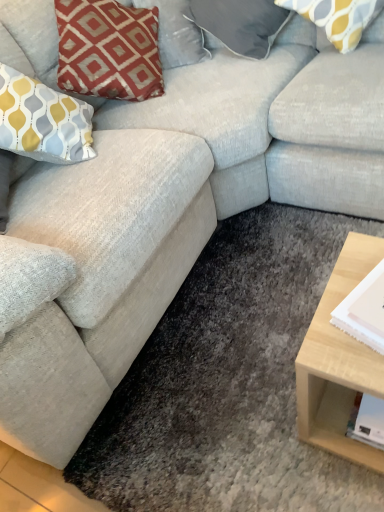
In order to face white paper at right, should I rotate leftwards or rightwards?

You should rotate right by 29.038 degrees.

Where is `white paper at right`? The width and height of the screenshot is (384, 512). white paper at right is located at coordinates (356, 317).

Is satin gray pillow at upper center, arranged as the 1th pillow when viewed from the left, oriented away from white paper at right?

No, white paper at right is not at the back of satin gray pillow at upper center, arranged as the 1th pillow when viewed from the left.

Considering the positions of objects satin gray pillow at upper center, arranged as the 1th pillow when viewed from the left, and white paper at right in the image provided, who is more to the right, satin gray pillow at upper center, arranged as the 1th pillow when viewed from the left, or white paper at right?

Positioned to the right is white paper at right.

This screenshot has width=384, height=512. There is a white paper at right. What are the coordinates of `the 1st pillow above it (from a real-world perspective)` in the screenshot? It's located at (240, 23).

From a real-world perspective, who is located higher, satin gray pillow at upper center, arranged as the 1th pillow when viewed from the left, or white paper at right?

In real-world perspective, satin gray pillow at upper center, arranged as the 1th pillow when viewed from the left, is above.

Is yellow and gray patterned pillow at upper right, positioned as the 2th pillow in left-to-right order, positioned before white paper at right?

No, yellow and gray patterned pillow at upper right, positioned as the 2th pillow in left-to-right order, is behind white paper at right.

Is yellow and gray patterned pillow at upper right, which appears as the first pillow when viewed from the right, inside or outside of white paper at right?

yellow and gray patterned pillow at upper right, which appears as the first pillow when viewed from the right, is not enclosed by white paper at right.

From a real-world perspective, who is located higher, yellow and gray patterned pillow at upper right, which appears as the first pillow when viewed from the right, or white paper at right?

yellow and gray patterned pillow at upper right, which appears as the first pillow when viewed from the right, from a real-world perspective.

Is yellow and gray patterned pillow at upper right, positioned as the 2th pillow in left-to-right order, facing towards white paper at right?

Yes, yellow and gray patterned pillow at upper right, positioned as the 2th pillow in left-to-right order, faces towards white paper at right.

Is the surface of yellow and gray patterned pillow at upper right, which appears as the first pillow when viewed from the right, in direct contact with satin gray pillow at upper center, arranged as the 1th pillow when viewed from the left?

yellow and gray patterned pillow at upper right, which appears as the first pillow when viewed from the right, is not next to satin gray pillow at upper center, arranged as the 1th pillow when viewed from the left, and they're not touching.

Does yellow and gray patterned pillow at upper right, which appears as the first pillow when viewed from the right, have a lesser width compared to satin gray pillow at upper center, arranged as the 1th pillow when viewed from the left?

Indeed, yellow and gray patterned pillow at upper right, which appears as the first pillow when viewed from the right, has a lesser width compared to satin gray pillow at upper center, arranged as the 1th pillow when viewed from the left.

From a real-world perspective, is yellow and gray patterned pillow at upper right, positioned as the 2th pillow in left-to-right order, located beneath satin gray pillow at upper center, which appears as the 2th pillow when viewed from the right?

Actually, yellow and gray patterned pillow at upper right, positioned as the 2th pillow in left-to-right order, is physically above satin gray pillow at upper center, which appears as the 2th pillow when viewed from the right, in the real world.

Is yellow and gray patterned pillow at upper right, positioned as the 2th pillow in left-to-right order, behind satin gray pillow at upper center, arranged as the 1th pillow when viewed from the left?

No.

Is white paper at right turned away from satin gray pillow at upper center, which appears as the 2th pillow when viewed from the right?

That's not correct — white paper at right is not looking away from satin gray pillow at upper center, which appears as the 2th pillow when viewed from the right.

In order to click on magazine located underneath the satin gray pillow at upper center, arranged as the 1th pillow when viewed from the left (from a real-world perspective) in this screenshot , I will do `click(356, 317)`.

From a real-world perspective, is white paper at right over satin gray pillow at upper center, arranged as the 1th pillow when viewed from the left?

No, from a real-world perspective, white paper at right is not over satin gray pillow at upper center, arranged as the 1th pillow when viewed from the left

Based on their sizes in the image, would you say white paper at right is bigger or smaller than satin gray pillow at upper center, which appears as the 2th pillow when viewed from the right?

In the image, white paper at right appears to be smaller than satin gray pillow at upper center, which appears as the 2th pillow when viewed from the right.

In the scene shown: Considering their positions, is white paper at right located in front of or behind yellow and gray patterned pillow at upper right, which appears as the first pillow when viewed from the right?

white paper at right is positioned closer to the viewer than yellow and gray patterned pillow at upper right, which appears as the first pillow when viewed from the right.

From a real-world perspective, is white paper at right positioned above or below yellow and gray patterned pillow at upper right, which appears as the first pillow when viewed from the right?

white paper at right is situated lower than yellow and gray patterned pillow at upper right, which appears as the first pillow when viewed from the right, in the real world.

Considering the positions of point (352, 304) and point (357, 18), is point (352, 304) closer or farther from the camera than point (357, 18)?

Point (352, 304) is positioned closer to the camera compared to point (357, 18).

Is satin gray pillow at upper center, which appears as the 2th pillow when viewed from the right, with yellow and gray patterned pillow at upper right, positioned as the 2th pillow in left-to-right order?

No, satin gray pillow at upper center, which appears as the 2th pillow when viewed from the right, is not touching yellow and gray patterned pillow at upper right, positioned as the 2th pillow in left-to-right order.

Does satin gray pillow at upper center, which appears as the 2th pillow when viewed from the right, come behind yellow and gray patterned pillow at upper right, which appears as the first pillow when viewed from the right?

Yes, it is behind yellow and gray patterned pillow at upper right, which appears as the first pillow when viewed from the right.

Is satin gray pillow at upper center, which appears as the 2th pillow when viewed from the right, wider or thinner than yellow and gray patterned pillow at upper right, which appears as the first pillow when viewed from the right?

In the image, satin gray pillow at upper center, which appears as the 2th pillow when viewed from the right, appears to be wider than yellow and gray patterned pillow at upper right, which appears as the first pillow when viewed from the right.

Is satin gray pillow at upper center, which appears as the 2th pillow when viewed from the right, to the right of yellow and gray patterned pillow at upper right, which appears as the first pillow when viewed from the right, from the viewer's perspective?

No, satin gray pillow at upper center, which appears as the 2th pillow when viewed from the right, is not to the right of yellow and gray patterned pillow at upper right, which appears as the first pillow when viewed from the right.

Where is `pillow on the left of white paper at right`? The width and height of the screenshot is (384, 512). pillow on the left of white paper at right is located at coordinates (240, 23).

This screenshot has width=384, height=512. I want to click on the 1st pillow behind the white paper at right, so click(337, 18).

Based on their spatial positions, is satin gray pillow at upper center, which appears as the 2th pillow when viewed from the right, or white paper at right further from yellow and gray patterned pillow at upper right, which appears as the first pillow when viewed from the right?

The object further to yellow and gray patterned pillow at upper right, which appears as the first pillow when viewed from the right, is white paper at right.

Looking at the image, which one is located closer to yellow and gray patterned pillow at upper right, positioned as the 2th pillow in left-to-right order, white paper at right or satin gray pillow at upper center, arranged as the 1th pillow when viewed from the left?

Based on the image, satin gray pillow at upper center, arranged as the 1th pillow when viewed from the left, appears to be nearer to yellow and gray patterned pillow at upper right, positioned as the 2th pillow in left-to-right order.

Looking at the image, which one is located closer to white paper at right, satin gray pillow at upper center, arranged as the 1th pillow when viewed from the left, or yellow and gray patterned pillow at upper right, positioned as the 2th pillow in left-to-right order?

yellow and gray patterned pillow at upper right, positioned as the 2th pillow in left-to-right order, is closer to white paper at right.

Estimate the real-world distances between objects in this image. Which object is closer to satin gray pillow at upper center, arranged as the 1th pillow when viewed from the left, white paper at right or yellow and gray patterned pillow at upper right, which appears as the first pillow when viewed from the right?

yellow and gray patterned pillow at upper right, which appears as the first pillow when viewed from the right.

Estimate the real-world distances between objects in this image. Which object is further from white paper at right, yellow and gray patterned pillow at upper right, which appears as the first pillow when viewed from the right, or satin gray pillow at upper center, arranged as the 1th pillow when viewed from the left?

The object further to white paper at right is satin gray pillow at upper center, arranged as the 1th pillow when viewed from the left.

Based on the photo, estimate the real-world distances between objects in this image. Which object is closer to satin gray pillow at upper center, arranged as the 1th pillow when viewed from the left, yellow and gray patterned pillow at upper right, positioned as the 2th pillow in left-to-right order, or white paper at right?

The object closer to satin gray pillow at upper center, arranged as the 1th pillow when viewed from the left, is yellow and gray patterned pillow at upper right, positioned as the 2th pillow in left-to-right order.

This screenshot has height=512, width=384. Identify the location of pillow that lies between satin gray pillow at upper center, arranged as the 1th pillow when viewed from the left, and white paper at right from top to bottom. (337, 18).